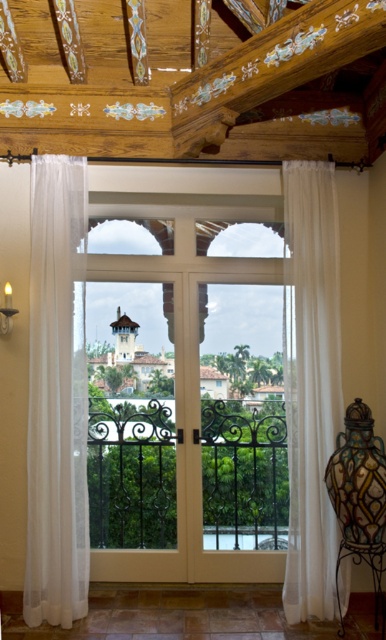
Consider the image. Who is positioned more to the right, white sheer curtains at center or white sheer curtain at right?

white sheer curtain at right

Between white sheer curtains at center and white sheer curtain at right, which one appears on the left side from the viewer's perspective?

white sheer curtains at center

This screenshot has height=640, width=386. I want to click on white sheer curtains at center, so click(194, 77).

Is sheer white curtain at left bigger than white wood screen door at center?

Incorrect, sheer white curtain at left is not larger than white wood screen door at center.

Who is higher up, sheer white curtain at left or white wood screen door at center?

sheer white curtain at left is higher up.

Locate an element on the screen. The width and height of the screenshot is (386, 640). sheer white curtain at left is located at coordinates pyautogui.click(x=57, y=396).

Which is above, white sheer curtains at center or white wood screen door at center?

white sheer curtains at center

Based on the photo, does white sheer curtains at center have a larger size compared to white wood screen door at center?

Yes, white sheer curtains at center is bigger than white wood screen door at center.

Find the location of a particular element. This screenshot has width=386, height=640. white sheer curtains at center is located at coordinates (194, 77).

I want to click on white sheer curtains at center, so 194,77.